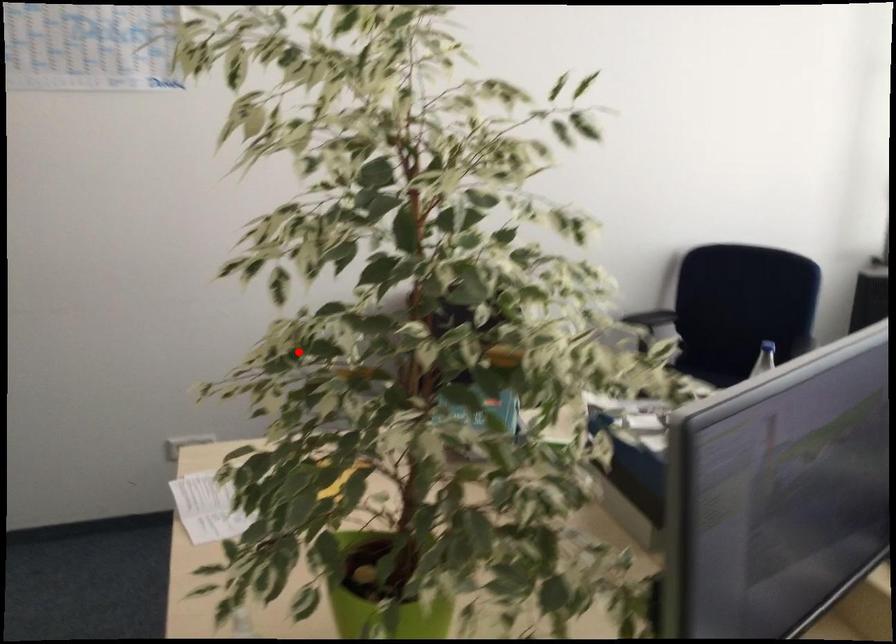
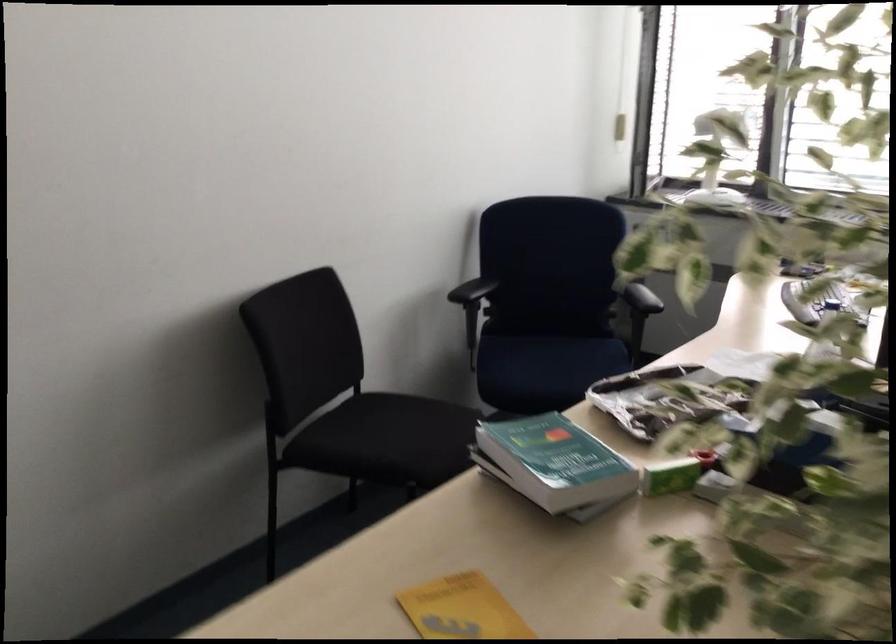
Find the pixel in the second image that matches the highlighted location in the first image.

(847, 480)